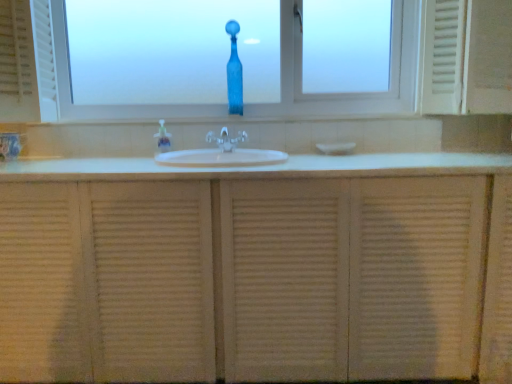
Where is `free point below white matte bar of soap at center (from a real-world perspective)`? The image size is (512, 384). free point below white matte bar of soap at center (from a real-world perspective) is located at coordinates (339, 149).